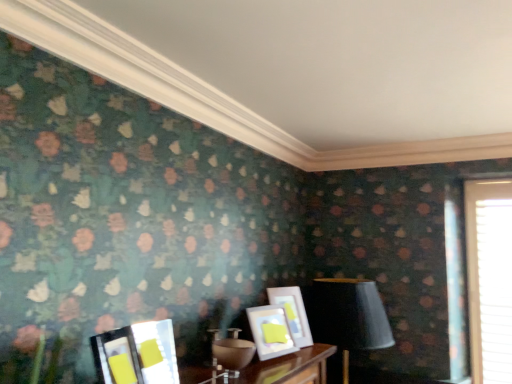
Question: From the image's perspective, is matte white picture frame at center, the first picture frame when ordered from back to front, under matte glass picture frame at lower left, the 3th picture frame in the back-to-front sequence?

Choices:
 (A) no
 (B) yes

Answer: (B)

Question: Does matte white picture frame at center, which ranks as the fourth picture frame in front-to-back order, have a greater height compared to matte glass picture frame at lower left, the 2th picture frame from the front?

Choices:
 (A) yes
 (B) no

Answer: (A)

Question: Considering the relative sizes of matte white picture frame at center, the first picture frame when ordered from back to front, and matte glass picture frame at lower left, the 2th picture frame from the front, in the image provided, is matte white picture frame at center, the first picture frame when ordered from back to front, bigger than matte glass picture frame at lower left, the 2th picture frame from the front,?

Choices:
 (A) yes
 (B) no

Answer: (A)

Question: Is matte white picture frame at center, the first picture frame when ordered from back to front, shorter than matte glass picture frame at lower left, the 3th picture frame in the back-to-front sequence?

Choices:
 (A) yes
 (B) no

Answer: (B)

Question: Does matte white picture frame at center, which ranks as the fourth picture frame in front-to-back order, appear on the right side of matte glass picture frame at lower left, the 2th picture frame from the front?

Choices:
 (A) no
 (B) yes

Answer: (B)

Question: Is matte white picture frame at center, the first picture frame when ordered from back to front, touching matte glass picture frame at lower left, the 2th picture frame from the front?

Choices:
 (A) no
 (B) yes

Answer: (A)

Question: Considering the relative sizes of matte black picture frame at lower left, which is counted as the fourth picture frame, starting from the back, and white textured blinds at right in the image provided, is matte black picture frame at lower left, which is counted as the fourth picture frame, starting from the back, taller than white textured blinds at right?

Choices:
 (A) no
 (B) yes

Answer: (A)

Question: From a real-world perspective, is matte black picture frame at lower left, which is counted as the fourth picture frame, starting from the back, located higher than white textured blinds at right?

Choices:
 (A) yes
 (B) no

Answer: (B)

Question: Considering the relative sizes of matte black picture frame at lower left, which is counted as the fourth picture frame, starting from the back, and white textured blinds at right in the image provided, is matte black picture frame at lower left, which is counted as the fourth picture frame, starting from the back, bigger than white textured blinds at right?

Choices:
 (A) no
 (B) yes

Answer: (A)

Question: From the image's perspective, would you say matte black picture frame at lower left, the 1th picture frame viewed from the front, is positioned over white textured blinds at right?

Choices:
 (A) yes
 (B) no

Answer: (A)

Question: Is matte black picture frame at lower left, the 1th picture frame viewed from the front, directly adjacent to white textured blinds at right?

Choices:
 (A) yes
 (B) no

Answer: (B)

Question: From a real-world perspective, does matte black picture frame at lower left, the 1th picture frame viewed from the front, sit lower than white textured blinds at right?

Choices:
 (A) no
 (B) yes

Answer: (B)

Question: From the image's perspective, is matte glass picture frame at lower left, the 2th picture frame from the front, under white textured blinds at right?

Choices:
 (A) no
 (B) yes

Answer: (A)